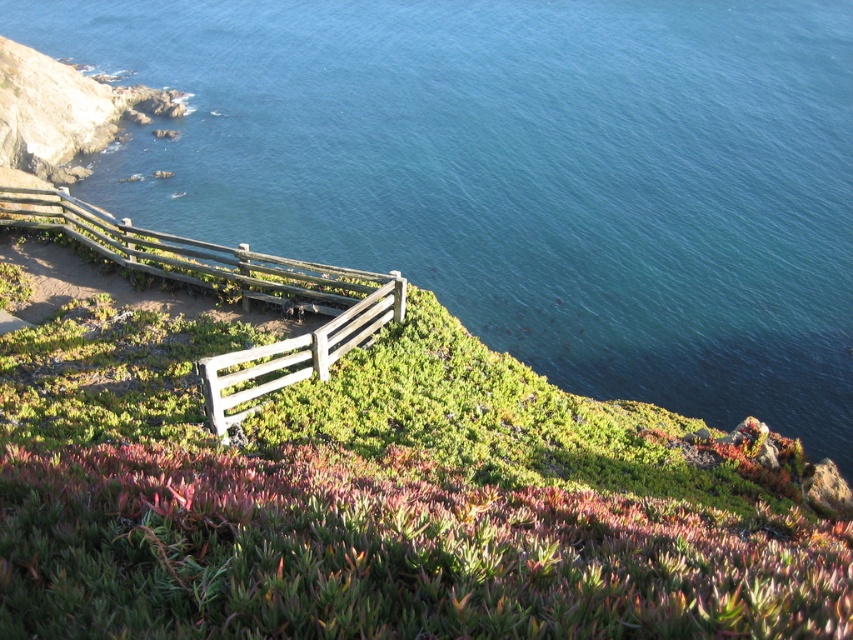
Question: Which object appears closest to the camera in this image?

Choices:
 (A) green succulent at lower center
 (B) wooden fence at center
 (C) blue water at upper center

Answer: (A)

Question: Among these points, which one is nearest to the camera?

Choices:
 (A) (125, 262)
 (B) (733, 346)

Answer: (A)

Question: Among these points, which one is nearest to the camera?

Choices:
 (A) (305, 262)
 (B) (785, 589)

Answer: (B)

Question: Can you confirm if green succulent at lower center is wider than wooden fence at center?

Choices:
 (A) yes
 (B) no

Answer: (B)

Question: Does blue water at upper center have a smaller size compared to green succulent at lower center?

Choices:
 (A) no
 (B) yes

Answer: (A)

Question: Does blue water at upper center appear on the left side of green succulent at lower center?

Choices:
 (A) yes
 (B) no

Answer: (B)